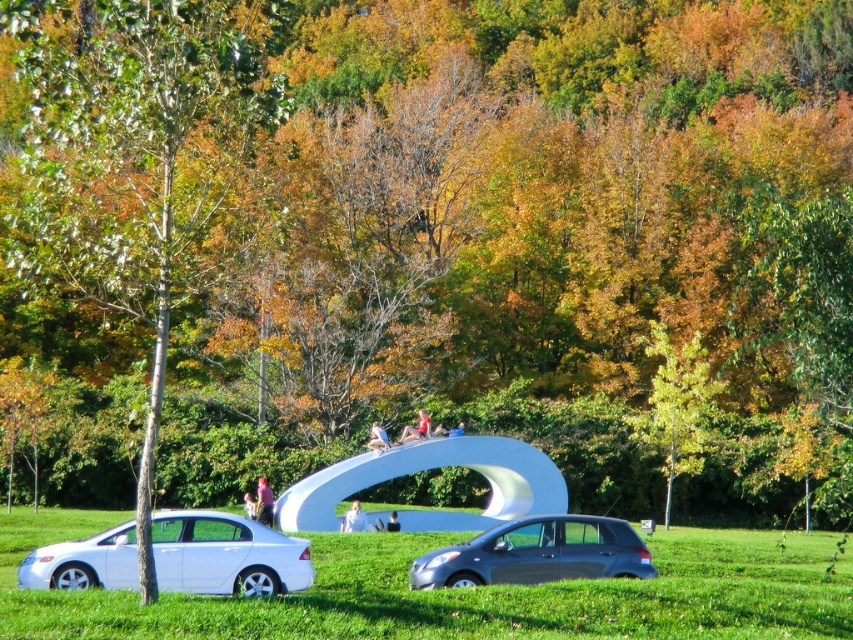
Between green leafy tree at left and green leafy tree at center, which one is positioned higher?

green leafy tree at left is above.

Is green leafy tree at left positioned behind green leafy tree at center?

No, green leafy tree at left is in front of green leafy tree at center.

Who is more distant from viewer, (148, 554) or (682, 374)?

The point (682, 374) is more distant.

In order to click on green leafy tree at left in this screenshot , I will do `click(138, 161)`.

Who is more forward, (267, 508) or (422, 433)?

Positioned in front is point (267, 508).

Describe the element at coordinates (264, 502) in the screenshot. I see `pink fabric shirt at center` at that location.

You are a GUI agent. You are given a task and a screenshot of the screen. Output one action in this format:
    pyautogui.click(x=<x>, y=<y>)
    Task: Click on the pink fabric shirt at center
    This screenshot has width=853, height=640.
    Given the screenshot: What is the action you would take?
    pyautogui.click(x=264, y=502)

Is matte gray hatchback at center above white matte person at center?

Indeed, matte gray hatchback at center is positioned over white matte person at center.

What do you see at coordinates (537, 554) in the screenshot? I see `matte gray hatchback at center` at bounding box center [537, 554].

Is point (421, 577) positioned behind point (363, 525)?

No.

Identify the location of matte gray hatchback at center. 537,554.